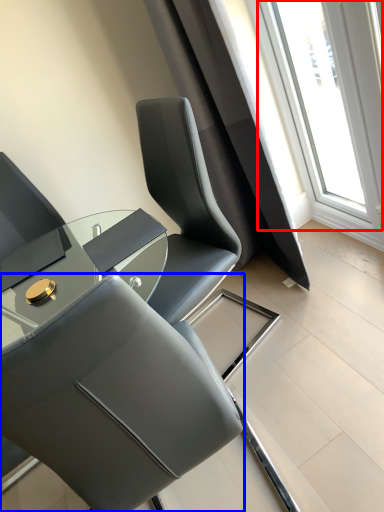
Question: Which point is further to the camera, window (highlighted by a red box) or chair (highlighted by a blue box)?

Choices:
 (A) window
 (B) chair

Answer: (A)